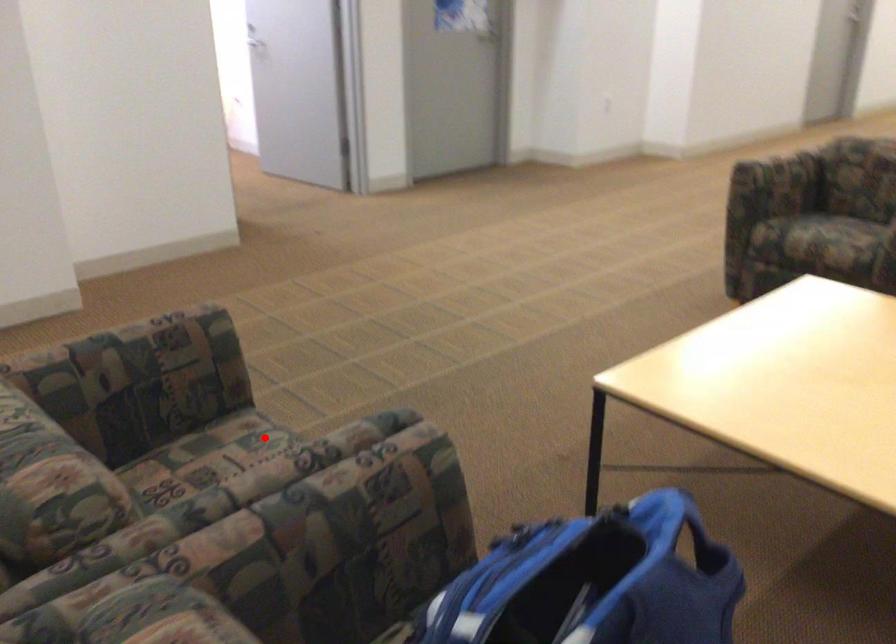
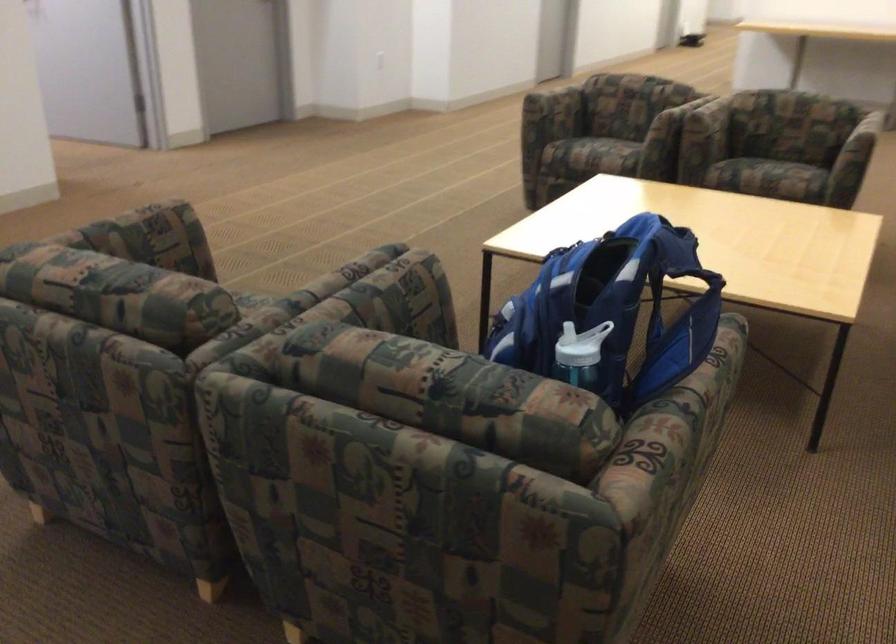
Question: I am providing you with two images of the same scene from different viewpoints. Image1 has a red point marked. In image2, the corresponding 3D location appears at what relative position? Reply with the corresponding letter.

Choices:
 (A) Closer
 (B) Farther

Answer: (B)